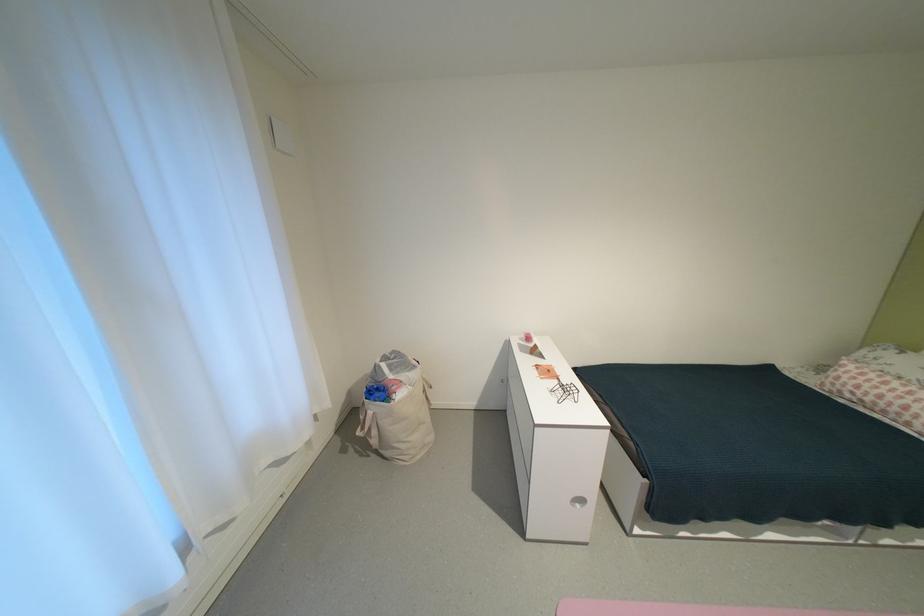
The location [877,392] corresponds to which object?

It corresponds to the pink patterned pillow in the image.